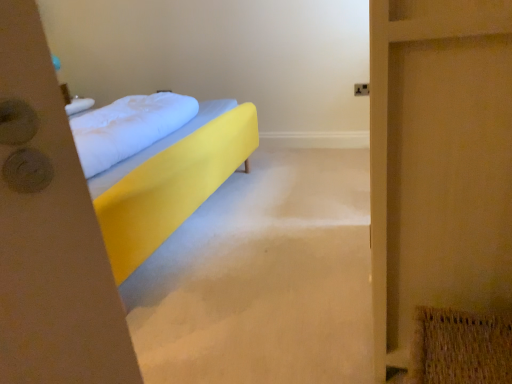
Describe the element at coordinates (438, 162) in the screenshot. I see `wooden screen door at right` at that location.

Image resolution: width=512 pixels, height=384 pixels. I want to click on white soft pillow at center, so click(x=128, y=127).

You are a GUI agent. You are given a task and a screenshot of the screen. Output one action in this format:
    pyautogui.click(x=<x>, y=<y>)
    Task: Click on the wooden screen door at right
    The height and width of the screenshot is (384, 512).
    Given the screenshot: What is the action you would take?
    pyautogui.click(x=438, y=162)

This screenshot has width=512, height=384. I want to click on pillow above the wooden screen door at right (from the image's perspective), so click(128, 127).

From the image's perspective, is wooden screen door at right under white soft pillow at center?

Correct, wooden screen door at right appears lower than white soft pillow at center in the image.

From a real-world perspective, is wooden screen door at right under white soft pillow at center?

Yes, from a real-world perspective, wooden screen door at right is below white soft pillow at center.

Which point is more forward, (170, 102) or (439, 59)?

Point (439, 59)

Would you consider white soft pillow at center to be distant from wooden screen door at right?

white soft pillow at center is positioned a significant distance from wooden screen door at right.

Which object is positioned more to the left, white soft pillow at center or wooden screen door at right?

Positioned to the left is white soft pillow at center.

Relative to wooden screen door at right, is white soft pillow at center in front or behind?

In the image, white soft pillow at center appears behind wooden screen door at right.

At what (x,y) coordinates should I click in order to perform the action: click on bed on the left of wooden screen door at right. Please return your answer as a coordinate pair (x, y). This screenshot has height=384, width=512. Looking at the image, I should click on (170, 181).

Is yellow fabric bed at center next to wooden screen door at right and touching it?

No.

Which object is thinner, yellow fabric bed at center or wooden screen door at right?

With smaller width is wooden screen door at right.

Which object is positioned more to the right, yellow fabric bed at center or wooden screen door at right?

Positioned to the right is wooden screen door at right.

Is wooden screen door at right at the left side of yellow fabric bed at center?

No.

From a real-world perspective, is wooden screen door at right on top of yellow fabric bed at center?

Yes.

Considering the sizes of objects wooden screen door at right and yellow fabric bed at center in the image provided, who is bigger, wooden screen door at right or yellow fabric bed at center?

With larger size is yellow fabric bed at center.

Is there a large distance between white soft pillow at center and yellow fabric bed at center?

No.

From the image's perspective, which is above, white soft pillow at center or yellow fabric bed at center?

white soft pillow at center is shown above in the image.

Is the position of white soft pillow at center more distant than that of yellow fabric bed at center?

Yes.

Does white soft pillow at center appear on the left side of yellow fabric bed at center?

No.

Is yellow fabric bed at center to the right of white soft pillow at center from the viewer's perspective?

Incorrect, yellow fabric bed at center is not on the right side of white soft pillow at center.

Is yellow fabric bed at center further to the viewer compared to white soft pillow at center?

No, yellow fabric bed at center is closer to the viewer.

How many degrees apart are the facing directions of yellow fabric bed at center and white soft pillow at center?

There is a 9.38e-05-degree angle between the facing directions of yellow fabric bed at center and white soft pillow at center.

From a real-world perspective, is yellow fabric bed at center physically above white soft pillow at center?

No, from a real-world perspective, yellow fabric bed at center is not above white soft pillow at center.

Find the location of a particular element. This screenshot has width=512, height=384. screen door located on the right of white soft pillow at center is located at coordinates (438, 162).

Where is `pillow above the wooden screen door at right (from the image's perspective)`? Image resolution: width=512 pixels, height=384 pixels. pillow above the wooden screen door at right (from the image's perspective) is located at coordinates (128, 127).

From the picture: Considering their positions, is wooden screen door at right positioned further to white soft pillow at center than yellow fabric bed at center?

Based on the image, wooden screen door at right appears to be further to white soft pillow at center.

Estimate the real-world distances between objects in this image. Which object is closer to wooden screen door at right, yellow fabric bed at center or white soft pillow at center?

Among the two, yellow fabric bed at center is located nearer to wooden screen door at right.

From the image, which object appears to be farther from white soft pillow at center, yellow fabric bed at center or wooden screen door at right?

The object further to white soft pillow at center is wooden screen door at right.

Based on the photo, when comparing their distances from yellow fabric bed at center, does white soft pillow at center or wooden screen door at right seem further?

Among the two, wooden screen door at right is located further to yellow fabric bed at center.

From the picture: Which object lies further to the anchor point yellow fabric bed at center, wooden screen door at right or white soft pillow at center?

wooden screen door at right is further to yellow fabric bed at center.

When comparing their distances from wooden screen door at right, does white soft pillow at center or yellow fabric bed at center seem closer?

yellow fabric bed at center is positioned closer to the anchor wooden screen door at right.

Image resolution: width=512 pixels, height=384 pixels. I want to click on pillow located between yellow fabric bed at center and wooden screen door at right in the left-right direction, so click(128, 127).